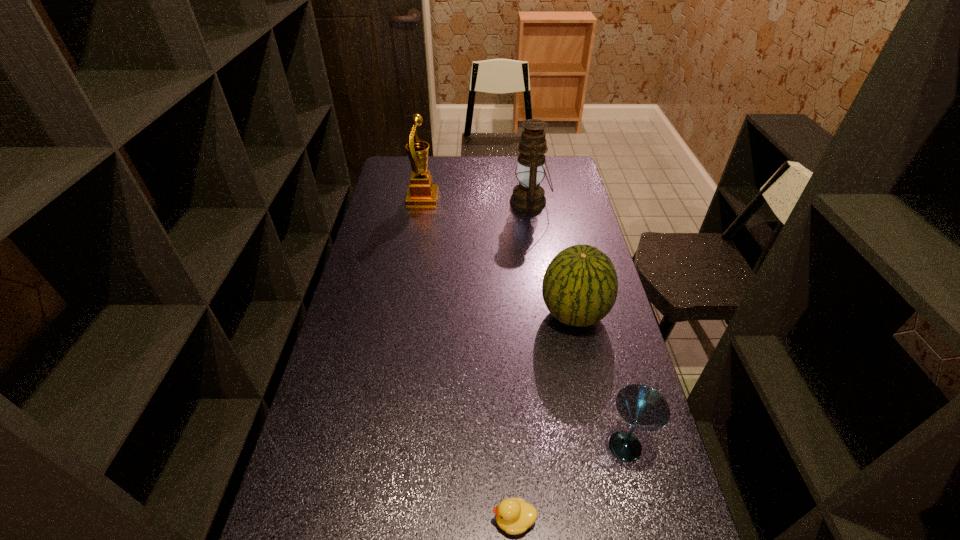
Where is `vacant area situated 0.360m on the back of the third farthest object`? This screenshot has width=960, height=540. vacant area situated 0.360m on the back of the third farthest object is located at coordinates (556, 227).

The width and height of the screenshot is (960, 540). Identify the location of vacant region located on the front of the martini. (642, 514).

The height and width of the screenshot is (540, 960). In order to click on vacant region located 0.130m on the beak of the fourth object from right to left in this screenshot , I will do `click(435, 520)`.

This screenshot has width=960, height=540. What are the coordinates of `vacant space situated on the beak of the fourth object from right to left` in the screenshot? It's located at (439, 520).

Find the location of a particular element. free space located 0.330m on the beak of the fourth object from right to left is located at coordinates (346, 520).

The height and width of the screenshot is (540, 960). Find the location of `object at the left edge`. object at the left edge is located at coordinates (421, 191).

This screenshot has height=540, width=960. Identify the location of oil lamp that is at the right edge. (528, 196).

You are a GUI agent. You are given a task and a screenshot of the screen. Output one action in this format:
    pyautogui.click(x=<x>, y=<y>)
    Task: Click on the watermelon that is at the right edge
    The height and width of the screenshot is (540, 960).
    Given the screenshot: What is the action you would take?
    pyautogui.click(x=580, y=285)

In order to click on martini that is at the right edge in this screenshot , I will do `click(642, 407)`.

Find the location of `vacant space at the far edge of the desktop`. vacant space at the far edge of the desktop is located at coordinates point(459,160).